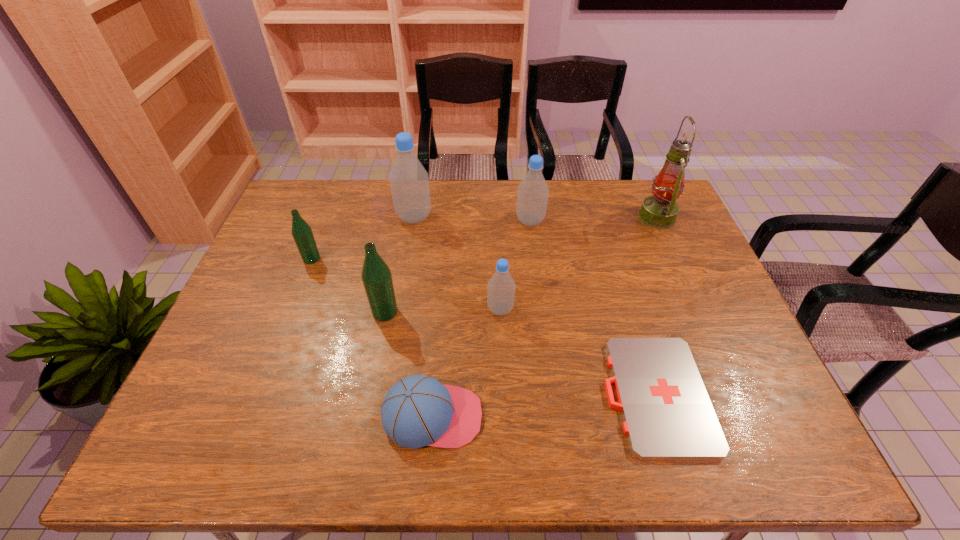
Where is `vacant space that's between the blue baseball cap and the smallest gray bottle`? This screenshot has height=540, width=960. vacant space that's between the blue baseball cap and the smallest gray bottle is located at coordinates (467, 363).

Where is `vacant space that's between the third farthest bottle and the second shortest object`? This screenshot has height=540, width=960. vacant space that's between the third farthest bottle and the second shortest object is located at coordinates (372, 338).

Identify the location of vacant space that's between the baseball cap and the left green bottle. (372, 338).

Find the location of a particular element. The height and width of the screenshot is (540, 960). empty location between the second object from right to left and the green oil lamp is located at coordinates (656, 306).

The image size is (960, 540). In order to click on free spot between the baseball cap and the left green bottle in this screenshot , I will do `click(372, 338)`.

I want to click on vacant area that lies between the nearest gray bottle and the gray first-aid kit, so click(x=578, y=352).

The width and height of the screenshot is (960, 540). What are the coordinates of `free area in between the nearest gray bottle and the leftmost bottle` in the screenshot? It's located at [x=406, y=284].

Locate an element on the screen. The width and height of the screenshot is (960, 540). vacant region between the biggest gray bottle and the fourth farthest object is located at coordinates (363, 238).

Locate an element on the screen. Image resolution: width=960 pixels, height=540 pixels. unoccupied area between the rightmost gray bottle and the right green bottle is located at coordinates (458, 267).

The width and height of the screenshot is (960, 540). In order to click on unoccupied area between the second biggest gray bottle and the blue baseball cap in this screenshot , I will do `click(482, 319)`.